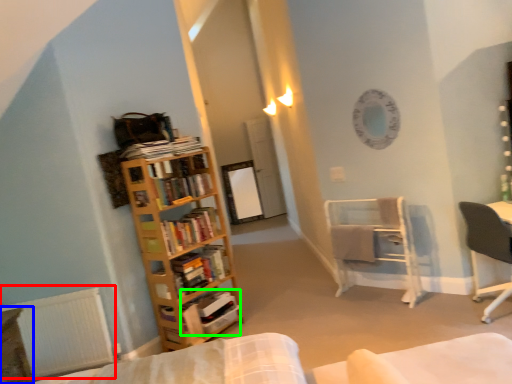
Question: Estimate the real-world distances between objects in this image. Which object is closer to radiator (highlighted by a red box), table (highlighted by a blue box) or book (highlighted by a green box)?

Choices:
 (A) table
 (B) book

Answer: (A)